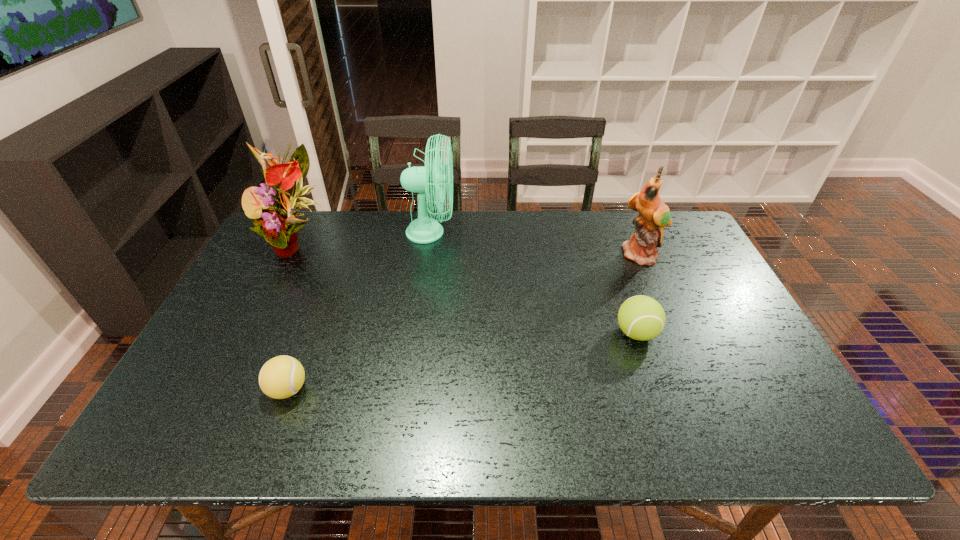
Find the location of a particular element. blank space at the near edge is located at coordinates (594, 442).

Where is `vacant region at the left edge of the desktop`? vacant region at the left edge of the desktop is located at coordinates (238, 361).

Where is `blank space at the right edge`? blank space at the right edge is located at coordinates (696, 273).

Where is `blank space at the far right corner`? blank space at the far right corner is located at coordinates (691, 232).

At what (x,y) coordinates should I click in order to perform the action: click on free space between the parrot and the bouquet. Please return your answer as a coordinate pair (x, y). This screenshot has width=960, height=540. Looking at the image, I should click on (470, 249).

The width and height of the screenshot is (960, 540). What are the coordinates of `unoccupied position between the parrot and the farther tennis ball` in the screenshot? It's located at (639, 294).

The height and width of the screenshot is (540, 960). I want to click on empty space that is in between the bouquet and the third object from right to left, so click(365, 238).

This screenshot has width=960, height=540. In order to click on free space between the left tennis ball and the parrot in this screenshot , I will do coord(465,322).

The width and height of the screenshot is (960, 540). I want to click on free space that is in between the fan and the bouquet, so click(x=365, y=238).

You are a GUI agent. You are given a task and a screenshot of the screen. Output one action in this format:
    pyautogui.click(x=<x>, y=<y>)
    Task: Click on the vacant area that lies between the third object from right to left and the second shortest object
    
    Given the screenshot: What is the action you would take?
    pyautogui.click(x=534, y=283)